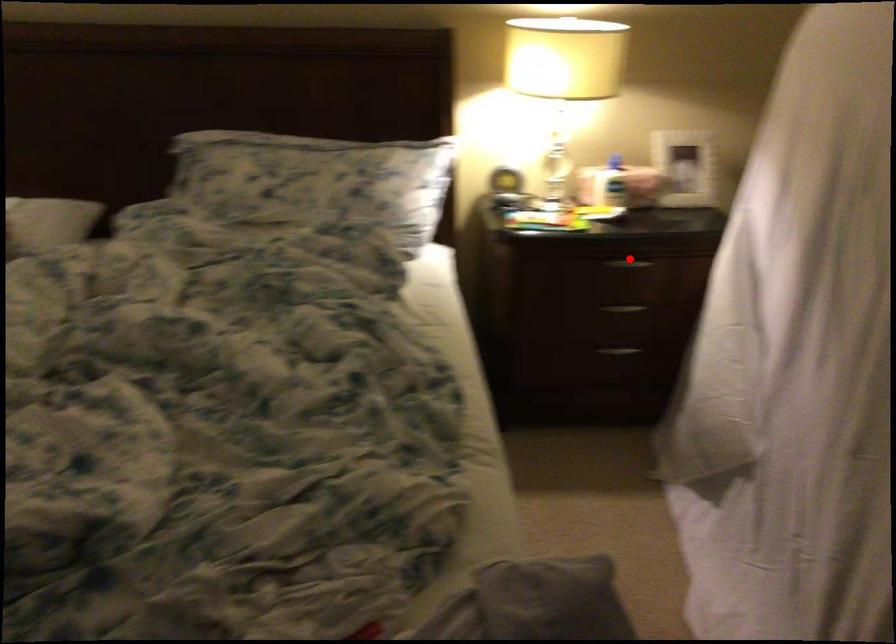
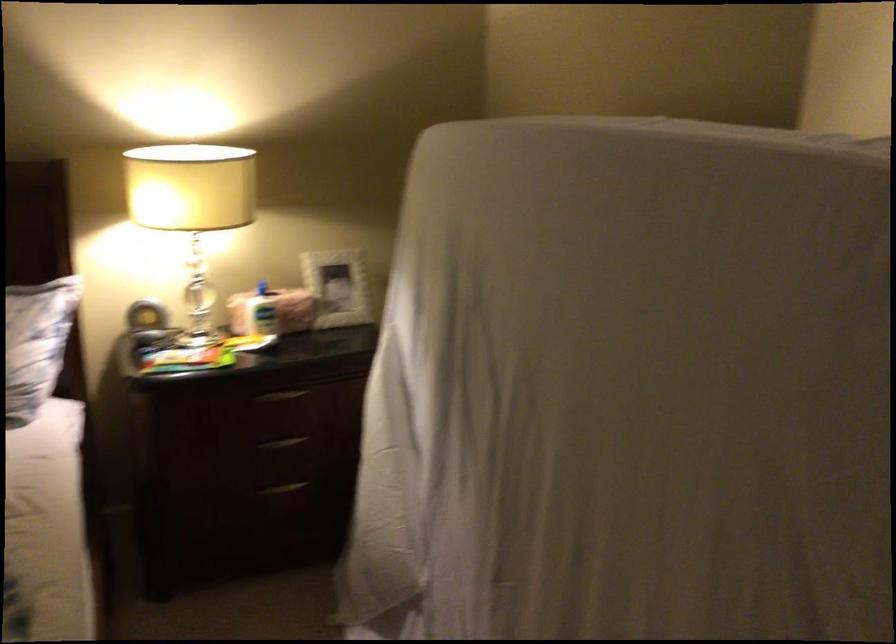
The point at the highlighted location is marked in the first image. Where is the corresponding point in the second image?

(280, 395)